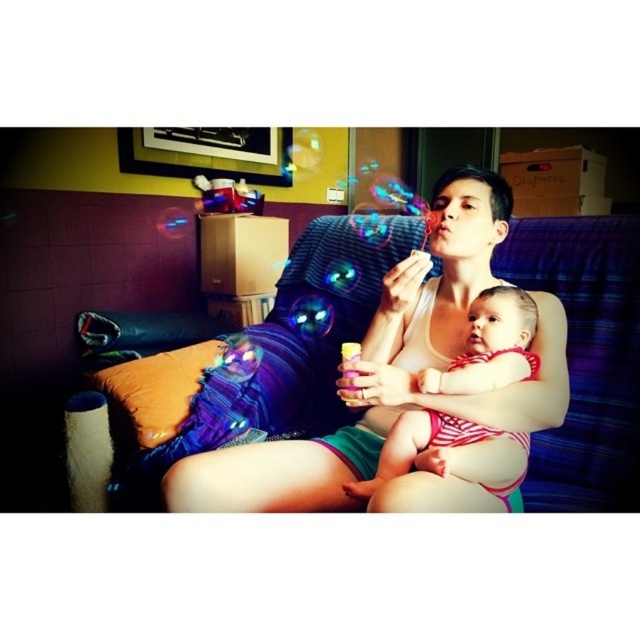
You are a photographer setting up for a family photo. You need to position a light source so it illuminates the matte white tank top at center without casting a shadow on the striped fabric baby at center. Where should you place the light relative to the two subjects?

The matte white tank top at center is located above the striped fabric baby at center. To avoid casting a shadow on the baby, the light should be placed directly above the matte white tank top at center so that its light shines downward, preventing the tank top from blocking the light to the baby below.

Looking at this image, you are a photographer trying to capture the perfect shot of the scene. To ensure the matte white tank top at center is in focus, where should you aim your camera lens?

The matte white tank top at center is located at the 2D coordinates point (403, 387), so aim your camera lens at that point to ensure it is in focus.

You are a photographer trying to capture a closeup of the baby in the scene. Since the baby is on the striped fabric baby at center, which is smaller than the matte white tank top at center, will you need to adjust your focus to account for the size difference?

The striped fabric baby at center is smaller than the matte white tank top at center. To capture a clear closeup of the baby, you should adjust your focus to ensure the smaller size of the striped fabric baby at center is properly in focus.